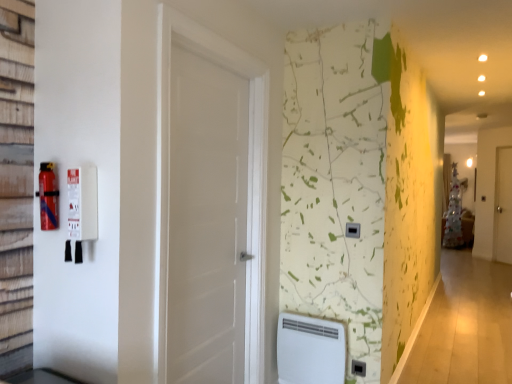
Question: Would you say white wooden door at right, which is the first door from back to front, is inside or outside black plastic/light switch at center-right?

Choices:
 (A) outside
 (B) inside

Answer: (A)

Question: Based on their positions, is white wooden door at right, the second door in the left-to-right sequence, located to the left or right of black plastic/light switch at center-right?

Choices:
 (A) left
 (B) right

Answer: (B)

Question: Which of these objects is positioned closest to the white plastic water heater at lower center?

Choices:
 (A) red matte fire extinguisher at left
 (B) white wooden door at right, which is counted as the 1th door, starting from the right
 (C) black plastic electric outlet at center
 (D) white matte door at center, the 2th door positioned from the right
 (E) black plastic/light switch at center-right

Answer: (C)

Question: Which object is the farthest from the white wooden door at right, which is the first door from back to front?

Choices:
 (A) black plastic electric outlet at center
 (B) white matte door at center, the first door when ordered from front to back
 (C) black plastic/light switch at center-right
 (D) white plastic water heater at lower center
 (E) red matte fire extinguisher at left

Answer: (E)